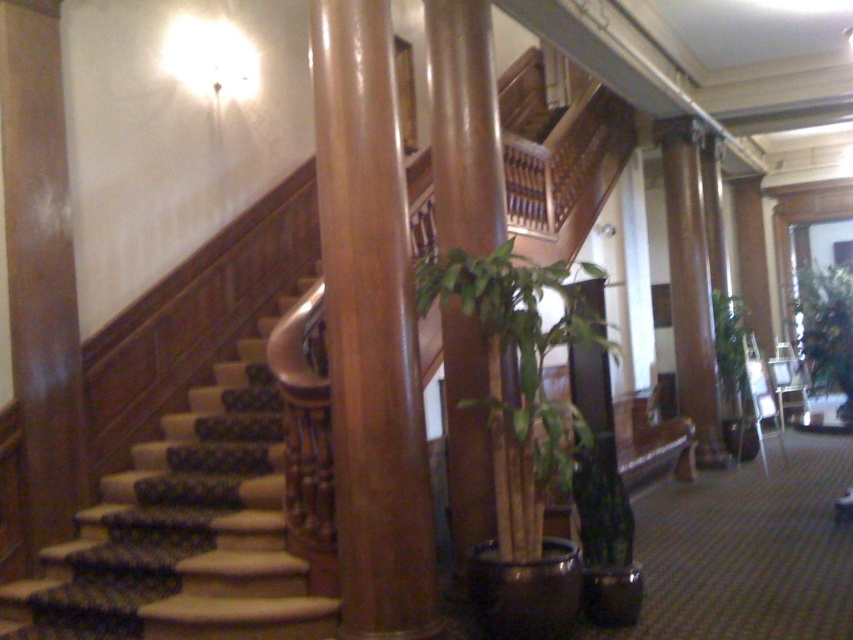
Is glossy wood pillar at center to the left of green leafy plant at center-right from the viewer's perspective?

Correct, you'll find glossy wood pillar at center to the left of green leafy plant at center-right.

Does glossy wood pillar at center have a greater width compared to green leafy plant at center-right?

No.

Find the location of a particular element. The width and height of the screenshot is (853, 640). glossy wood pillar at center is located at coordinates (370, 330).

The image size is (853, 640). Find the location of `glossy wood pillar at center`. glossy wood pillar at center is located at coordinates (370, 330).

Can you confirm if glossy wood pillar at center is taller than green leafy plant at center?

Yes.

Between point (416, 490) and point (506, 280), which one is positioned in front?

Point (416, 490) is in front.

Is point (421, 582) behind point (564, 332)?

No, (421, 582) is closer to viewer.

Identify the location of glossy wood pillar at center. (370, 330).

Based on the photo, can you confirm if carpeted wood stairs at left is shorter than polished wood pillar at center?

Incorrect, carpeted wood stairs at left's height does not fall short of polished wood pillar at center's.

Is carpeted wood stairs at left smaller than polished wood pillar at center?

No.

Locate an element on the screen. carpeted wood stairs at left is located at coordinates (184, 529).